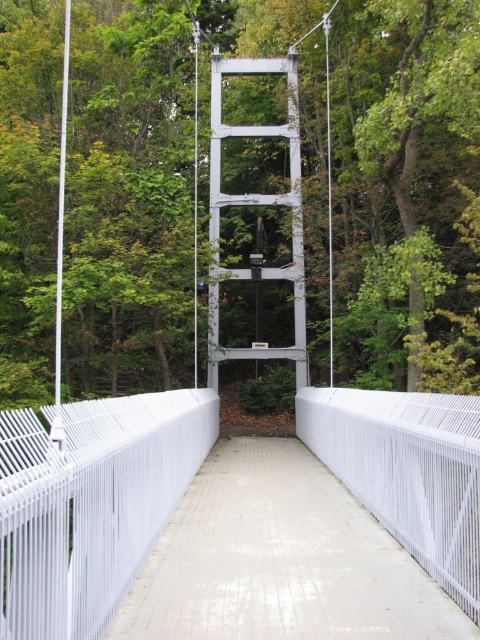
Question: Which of the following is the farthest from the observer?

Choices:
 (A) (348, 538)
 (B) (402, 356)

Answer: (B)

Question: Which point is farther from the camera taking this photo?

Choices:
 (A) (288, 488)
 (B) (312, 138)

Answer: (B)

Question: Observing the image, what is the correct spatial positioning of green leafy tree at center in reference to white glossy concrete path at center?

Choices:
 (A) below
 (B) above

Answer: (B)

Question: Does green leafy tree at center have a greater width compared to white glossy concrete path at center?

Choices:
 (A) yes
 (B) no

Answer: (A)

Question: Which point is farther from the camera taking this photo?

Choices:
 (A) (429, 352)
 (B) (376, 556)

Answer: (A)

Question: Observing the image, what is the correct spatial positioning of green leafy tree at center in reference to white glossy concrete path at center?

Choices:
 (A) below
 (B) above

Answer: (B)